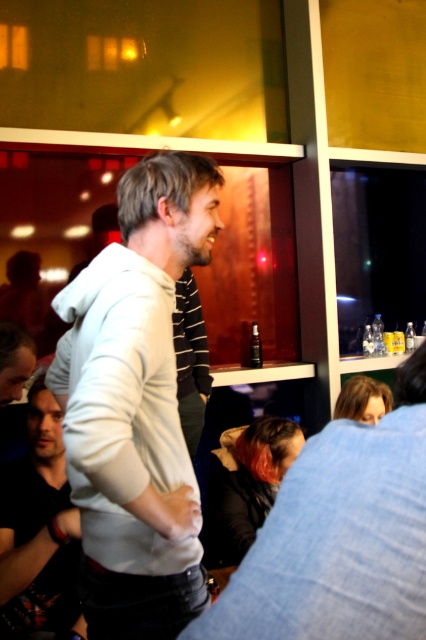
Question: Does white hoodie at center appear on the left side of dark gray hoodie at center?

Choices:
 (A) no
 (B) yes

Answer: (A)

Question: Considering the real-world distances, which object is farthest from the white hoodie at center?

Choices:
 (A) transparent plastic bottle at center
 (B) dark gray hoodie at center

Answer: (A)

Question: Which object appears closest to the camera in this image?

Choices:
 (A) white hoodie at center
 (B) dark gray hoodie at center
 (C) transparent plastic bottle at center

Answer: (A)

Question: Which point is closer to the camera taking this photo?

Choices:
 (A) (48, 403)
 (B) (123, 275)

Answer: (B)

Question: Is dark gray hoodie at center behind transparent plastic bottle at center?

Choices:
 (A) no
 (B) yes

Answer: (A)

Question: Is white hoodie at center closer to the viewer compared to dark gray hoodie at center?

Choices:
 (A) no
 (B) yes

Answer: (B)